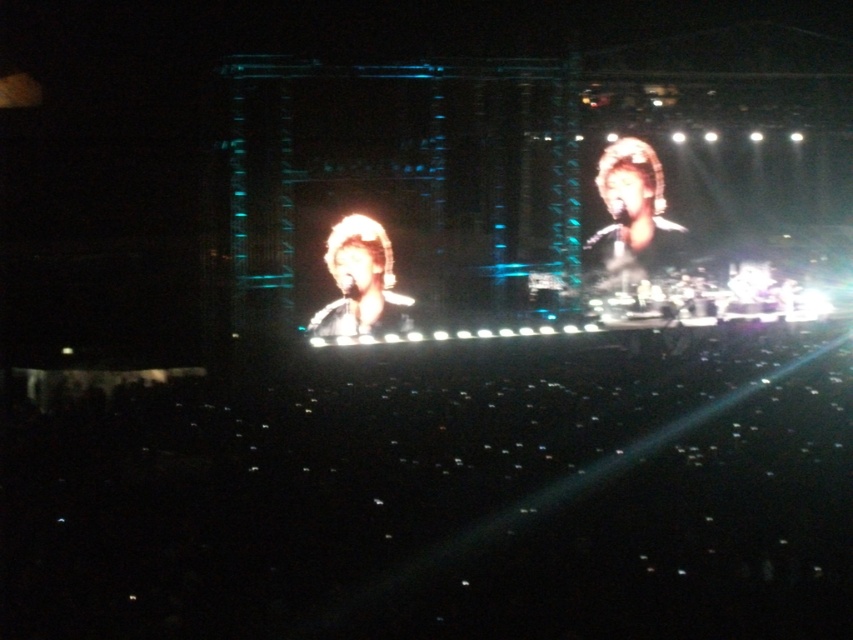
The height and width of the screenshot is (640, 853). What do you see at coordinates (360, 282) in the screenshot?
I see `shiny black microphone at center` at bounding box center [360, 282].

Can you confirm if shiny black microphone at center is wider than shiny gold headband at upper right?

Indeed, shiny black microphone at center has a greater width compared to shiny gold headband at upper right.

Image resolution: width=853 pixels, height=640 pixels. I want to click on shiny black microphone at center, so click(x=360, y=282).

This screenshot has width=853, height=640. Identify the location of shiny black microphone at center. (360, 282).